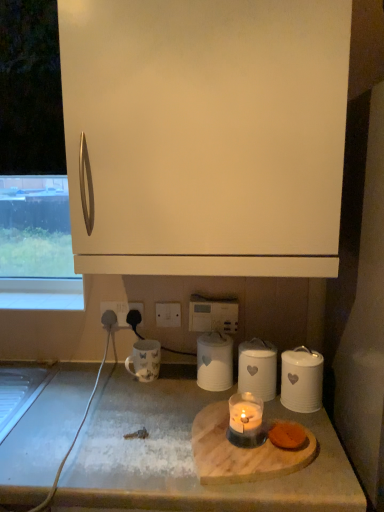
Where is `vacant space positioned to the left of white matte canister at center, the 2th kitchen appliance positioned from the right`? vacant space positioned to the left of white matte canister at center, the 2th kitchen appliance positioned from the right is located at coordinates (180, 397).